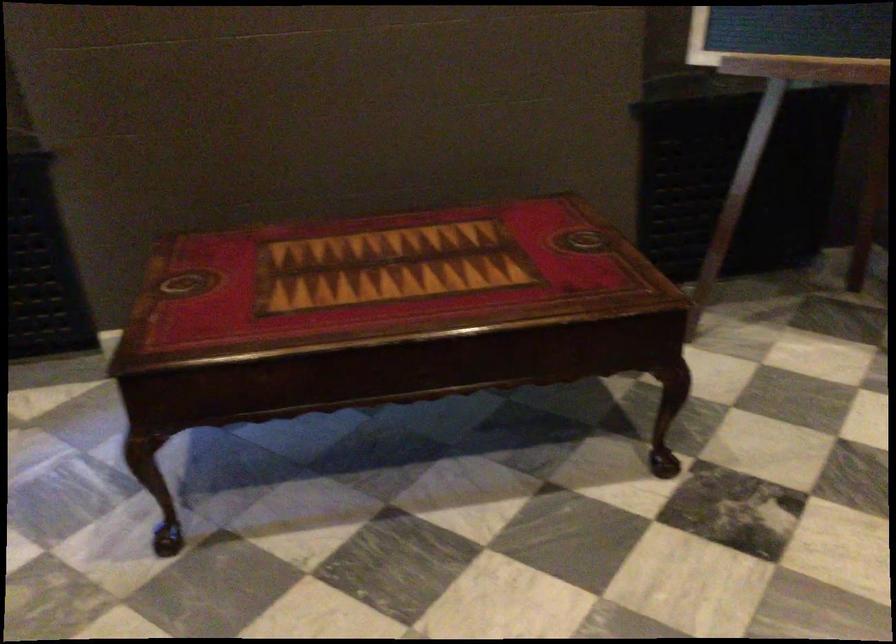
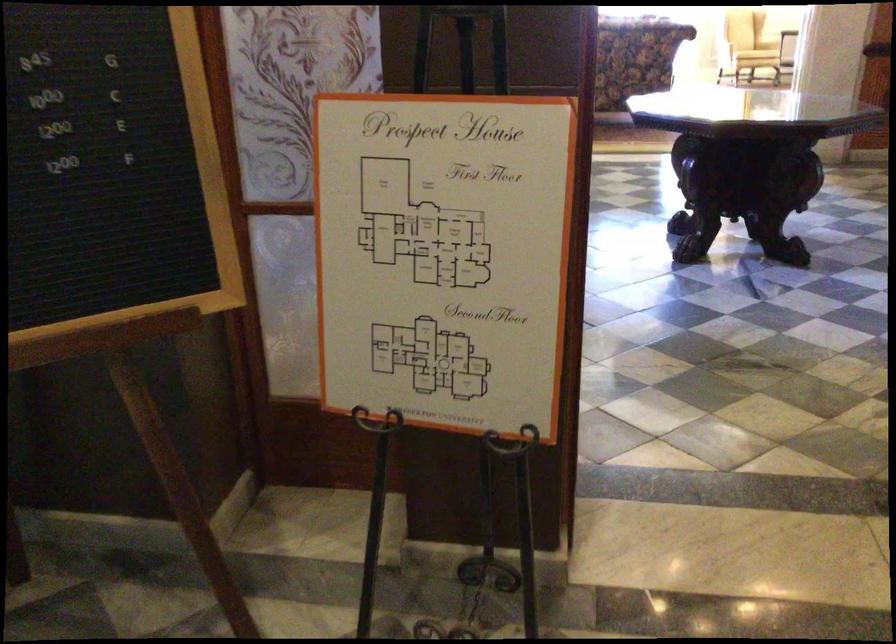
Question: Based on the continuous images, in which direction is the camera rotating? Reply with the corresponding letter.

Choices:
 (A) Left
 (B) Right
 (C) Up
 (D) Down

Answer: (B)